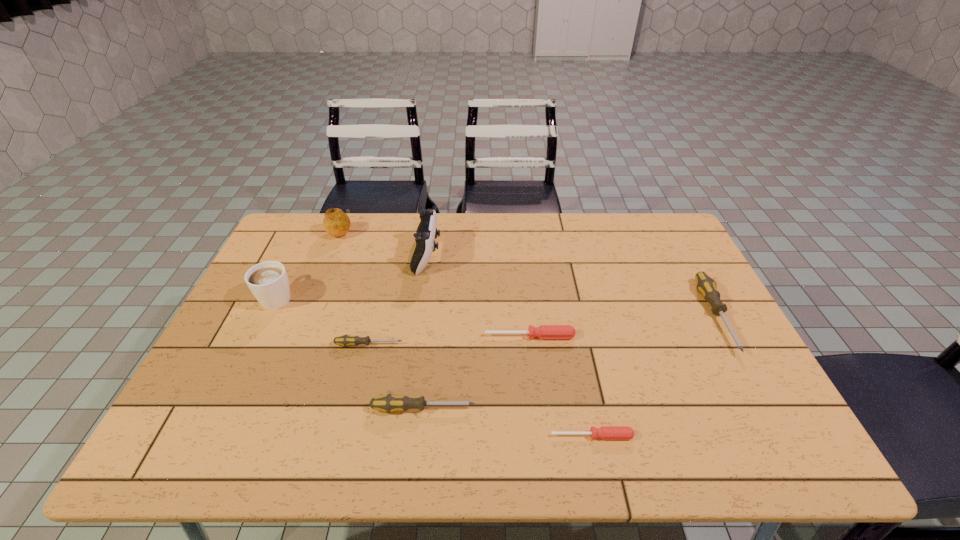
Where is `vacant point located between the bigger red screwdriver and the biggest gray screwdriver`? vacant point located between the bigger red screwdriver and the biggest gray screwdriver is located at coordinates (623, 326).

Find the location of a particular element. blank region between the rightmost screwdriver and the pear is located at coordinates (528, 273).

Where is `vacant space that is in between the pear and the rightmost object`? The image size is (960, 540). vacant space that is in between the pear and the rightmost object is located at coordinates (528, 273).

This screenshot has width=960, height=540. What are the coordinates of `free space between the pear and the bigger red screwdriver` in the screenshot? It's located at (435, 284).

Where is `the sixth closest object to the second smallest gray screwdriver`? This screenshot has width=960, height=540. the sixth closest object to the second smallest gray screwdriver is located at coordinates (336, 223).

Where is `object that can be found as the seventh closest to the nearest screwdriver`? The width and height of the screenshot is (960, 540). object that can be found as the seventh closest to the nearest screwdriver is located at coordinates (336, 223).

Identify the location of the closest screwdriver to the smaller red screwdriver. (388, 403).

Locate an element on the screen. The width and height of the screenshot is (960, 540). screwdriver that is the fourth closest one to the fourth tallest object is located at coordinates (346, 340).

You are a GUI agent. You are given a task and a screenshot of the screen. Output one action in this format:
    pyautogui.click(x=<x>, y=<y>)
    Task: Click on the gray screwdriver that is the nearest to the second biggest gray screwdriver
    This screenshot has width=960, height=540.
    Given the screenshot: What is the action you would take?
    pyautogui.click(x=346, y=340)

Identify the location of gray screwdriver that can be found as the second closest to the leftmost object. (388, 403).